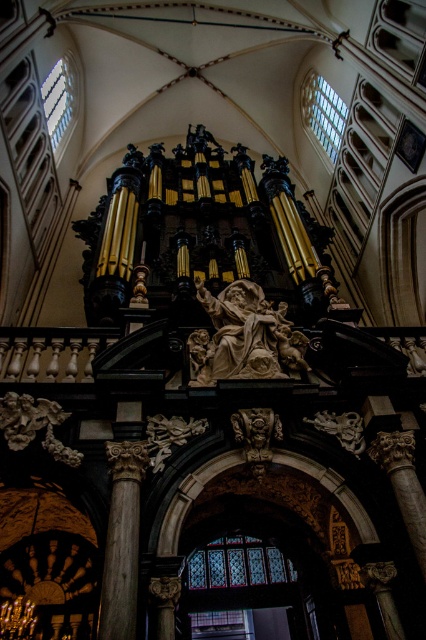
Looking at this image, can you confirm if white marble statue at center is smaller than wooden column at center?

No, white marble statue at center is not smaller than wooden column at center.

This screenshot has height=640, width=426. Describe the element at coordinates (244, 337) in the screenshot. I see `white marble statue at center` at that location.

You are a GUI agent. You are given a task and a screenshot of the screen. Output one action in this format:
    pyautogui.click(x=<x>, y=<y>)
    Task: Click on the white marble statue at center
    This screenshot has width=426, height=640.
    Given the screenshot: What is the action you would take?
    pyautogui.click(x=244, y=337)

Image resolution: width=426 pixels, height=640 pixels. What are the coordinates of `white marble statue at center` in the screenshot? It's located at (244, 337).